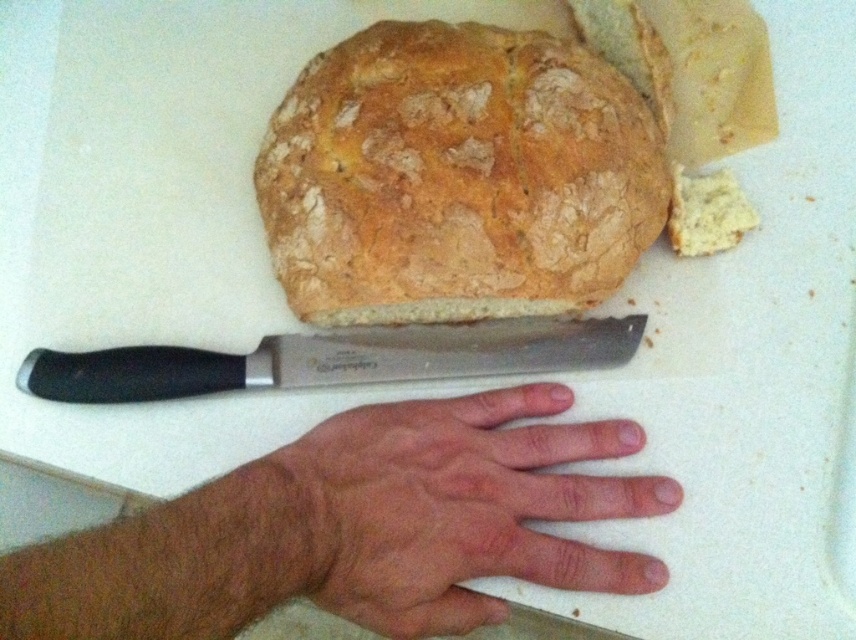
You are a baker who needs to slice the bread using the black plastic handle knife at center. However, there is a dry skin at center on the bread. Which object should you avoid cutting into because of its size?

The dry skin at center is larger in size than the black plastic handle knife at center, so you should avoid cutting into the dry skin at center because it is bigger and might not fit under the knife properly.

You need to slice the golden brown crusty bread at upper center using the black plastic handle knife at center. Can the knife reach the entire length of the bread?

The golden brown crusty bread at upper center is larger in size than black plastic handle knife at center, so the knife may not be long enough to reach the entire length of the bread.